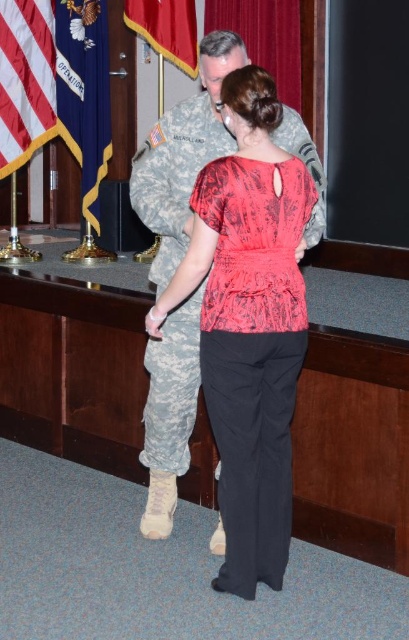
Question: Can you confirm if matte red blouse at center is bigger than american flag at left?

Choices:
 (A) yes
 (B) no

Answer: (A)

Question: Among these objects, which one is farthest from the camera?

Choices:
 (A) red velvet flag at upper left
 (B) american flag at left
 (C) matte red blouse at center

Answer: (A)

Question: Which of these objects is positioned closest to the red velvet flag at upper left?

Choices:
 (A) american flag at left
 (B) blue fabric flag at left

Answer: (B)

Question: Can you confirm if blue fabric flag at left is bigger than red velvet flag at upper left?

Choices:
 (A) no
 (B) yes

Answer: (B)

Question: Which of the following is the farthest from the observer?

Choices:
 (A) tap(8, 13)
 (B) tap(276, 394)
 (C) tap(103, 77)

Answer: (C)

Question: Is blue fabric flag at left smaller than american flag at left?

Choices:
 (A) no
 (B) yes

Answer: (A)